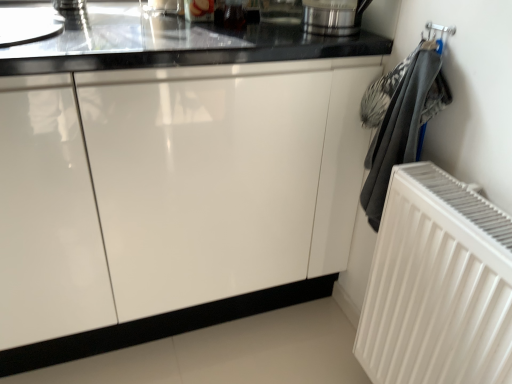
Question: Is white ribbed radiator at right wider or thinner than glossy white cabinet at center?

Choices:
 (A) wide
 (B) thin

Answer: (B)

Question: Considering their positions, is white ribbed radiator at right located in front of or behind glossy white cabinet at center?

Choices:
 (A) behind
 (B) front

Answer: (B)

Question: Estimate the real-world distances between objects in this image. Which object is farther from the white ribbed radiator at right?

Choices:
 (A) glossy white cabinet at center
 (B) polished stainless steel kettle at upper right

Answer: (B)

Question: Estimate the real-world distances between objects in this image. Which object is farther from the white ribbed radiator at right?

Choices:
 (A) polished stainless steel kettle at upper right
 (B) glossy white cabinet at center

Answer: (A)